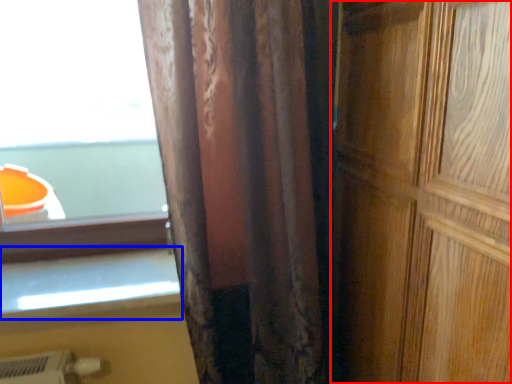
Question: Among these objects, which one is farthest to the camera, door (highlighted by a red box) or window sill (highlighted by a blue box)?

Choices:
 (A) door
 (B) window sill

Answer: (B)